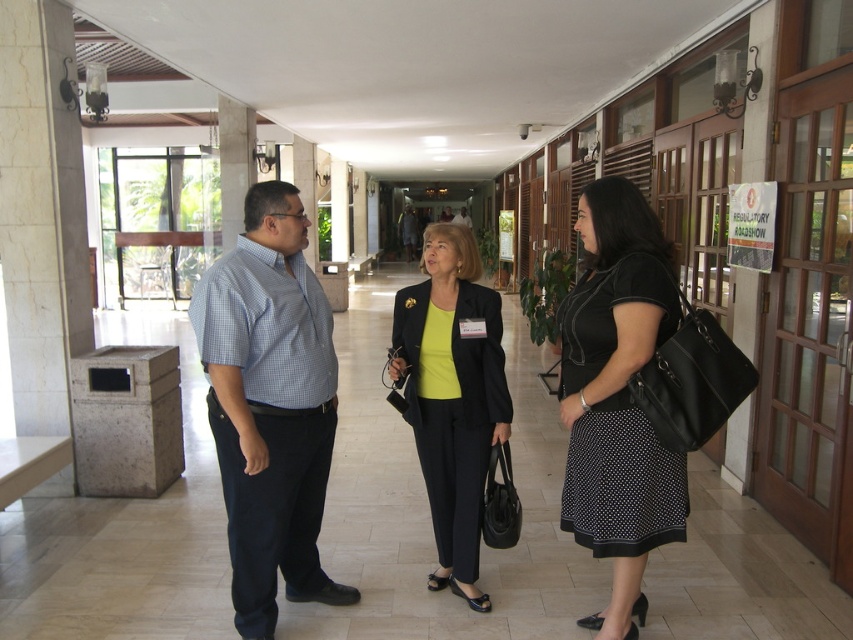
Is blue checkered shirt at center thinner than matte black blazer at center?

In fact, blue checkered shirt at center might be wider than matte black blazer at center.

Between blue checkered shirt at center and matte black blazer at center, which one is positioned lower?

matte black blazer at center

Is point (294, 365) behind point (445, 390)?

That is False.

This screenshot has height=640, width=853. Identify the location of blue checkered shirt at center. (270, 406).

Is point (254, 540) in front of point (583, 200)?

No, it is behind (583, 200).

Is point (294, 573) positioned before point (582, 497)?

No, (294, 573) is further to viewer.

Locate an element on the screen. This screenshot has width=853, height=640. blue checkered shirt at center is located at coordinates (270, 406).

Can you confirm if black dotted skirt at center is positioned above matte black blazer at center?

Yes, black dotted skirt at center is above matte black blazer at center.

Can you confirm if black dotted skirt at center is wider than matte black blazer at center?

No.

Image resolution: width=853 pixels, height=640 pixels. Describe the element at coordinates (618, 397) in the screenshot. I see `black dotted skirt at center` at that location.

Identify the location of black dotted skirt at center. The height and width of the screenshot is (640, 853). (618, 397).